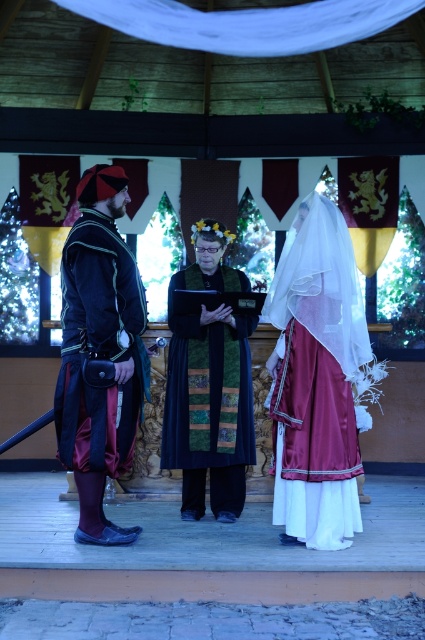
Can you confirm if velvet dark blue tunic at left is positioned above velvet green robe at center?

Yes, velvet dark blue tunic at left is above velvet green robe at center.

Is velvet dark blue tunic at left to the right of velvet green robe at center from the viewer's perspective?

Incorrect, velvet dark blue tunic at left is not on the right side of velvet green robe at center.

Locate an element on the screen. The width and height of the screenshot is (425, 640). velvet dark blue tunic at left is located at coordinates (99, 352).

At what (x,y) coordinates should I click in order to perform the action: click on velvet dark blue tunic at left. Please return your answer as a coordinate pair (x, y). Looking at the image, I should click on (99, 352).

Locate an element on the screen. This screenshot has height=640, width=425. velvet dark blue dress at center is located at coordinates (319, 374).

The width and height of the screenshot is (425, 640). Identify the location of velvet dark blue dress at center. (319, 374).

Is the position of velvet dark blue dress at center less distant than that of velvet green robe at center?

Yes, velvet dark blue dress at center is in front of velvet green robe at center.

Does point (317, 509) lie behind point (181, 385)?

That is False.

Who is more distant from viewer, [345,440] or [170,464]?

Point [170,464]

The width and height of the screenshot is (425, 640). I want to click on velvet dark blue dress at center, so click(x=319, y=374).